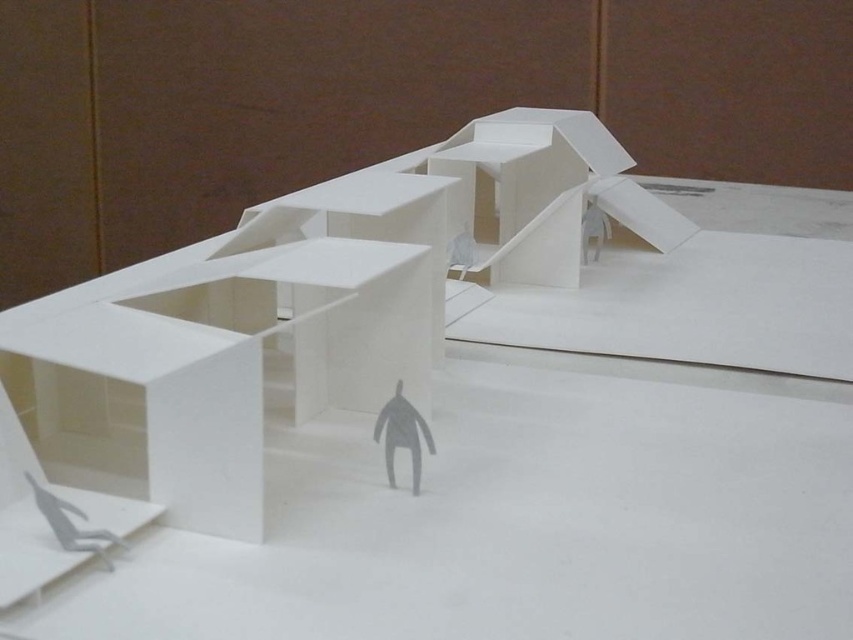
Who is higher up, white matte table at center or gray matte figure at center?

white matte table at center

Can you confirm if white matte table at center is positioned to the right of gray matte figure at center?

Correct, you'll find white matte table at center to the right of gray matte figure at center.

Identify the location of white matte table at center. The image size is (853, 640). (433, 456).

Image resolution: width=853 pixels, height=640 pixels. Find the location of `white matte table at center`. white matte table at center is located at coordinates (433, 456).